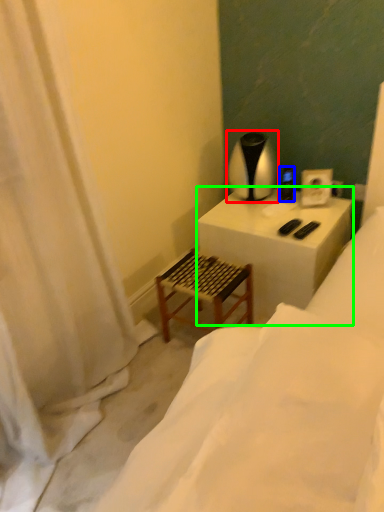
Question: Considering the real-world distances, which object is closest to table lamp (highlighted by a red box)? appliance (highlighted by a blue box) or table (highlighted by a green box).

Choices:
 (A) appliance
 (B) table

Answer: (A)